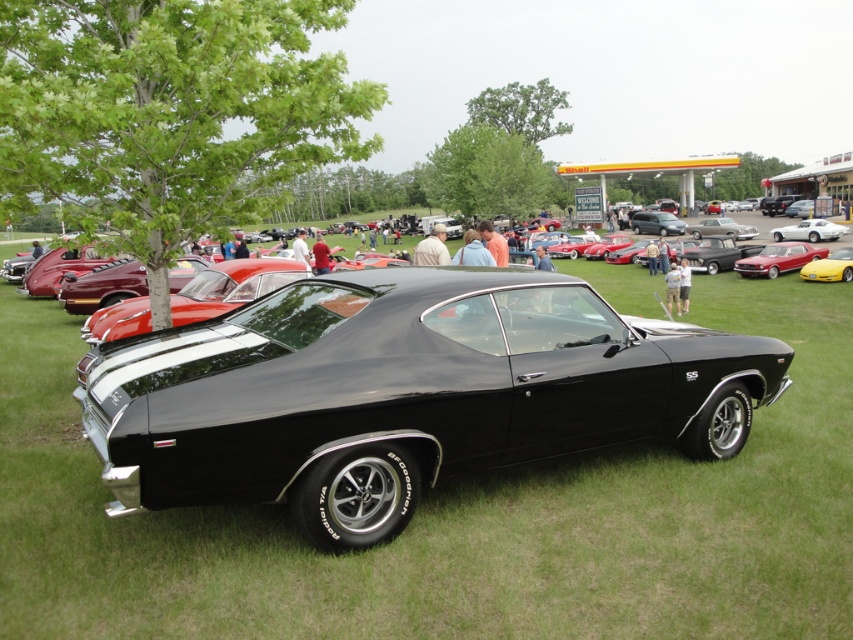
Question: Where is shiny red car at center right located in relation to glossy black car at center in the image?

Choices:
 (A) above
 (B) below

Answer: (B)

Question: Does yellow matte sports car at center have a greater width compared to white glossy sedan at right?

Choices:
 (A) yes
 (B) no

Answer: (B)

Question: Can you confirm if black glossy car at center is positioned to the left of white glossy sedan at right?

Choices:
 (A) yes
 (B) no

Answer: (A)

Question: Among these objects, which one is farthest from the camera?

Choices:
 (A) shiny red car at center right
 (B) black glossy car at center
 (C) white glossy sedan at right
 (D) glossy black car at center

Answer: (D)

Question: Which of the following is the farthest from the observer?

Choices:
 (A) glossy black car at center
 (B) white glossy sedan at right
 (C) black glossy car at center

Answer: (A)

Question: Which point is closer to the camera?

Choices:
 (A) shiny silver sedan at center
 (B) yellow matte sports car at center
 (C) white glossy sedan at right
 (D) shiny red car at center right

Answer: (B)